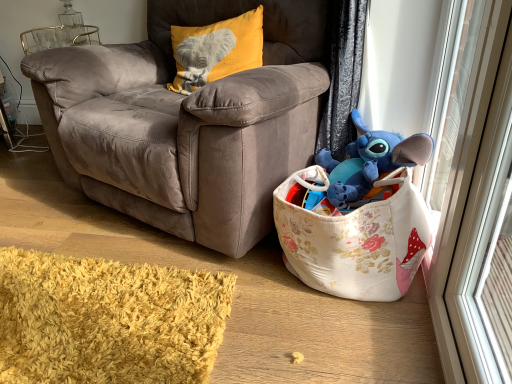
Describe the element at coordinates (476, 207) in the screenshot. The height and width of the screenshot is (384, 512). I see `transparent glass screen door at right` at that location.

Locate an element on the screen. velvet brown armchair at center is located at coordinates coord(187,122).

Where is `blue plush toy at upper right`? The width and height of the screenshot is (512, 384). blue plush toy at upper right is located at coordinates (371, 160).

Which of these two, floral fabric toy basket at lower right or blue plush toy at upper right, is thinner?

Thinner between the two is blue plush toy at upper right.

Is floral fabric toy basket at lower right looking in the opposite direction of blue plush toy at upper right?

That's not correct — floral fabric toy basket at lower right is not looking away from blue plush toy at upper right.

Would you say blue plush toy at upper right is part of floral fabric toy basket at lower right's contents?

Yes, floral fabric toy basket at lower right contains blue plush toy at upper right.

In the scene shown: From the image's perspective, between floral fabric toy basket at lower right and blue plush toy at upper right, who is located below?

floral fabric toy basket at lower right appears lower in the image.

Does transparent glass screen door at right have a greater height compared to velvet brown armchair at center?

No, transparent glass screen door at right is not taller than velvet brown armchair at center.

From a real-world perspective, is transparent glass screen door at right located beneath velvet brown armchair at center?

Yes.

Locate an element on the screen. The width and height of the screenshot is (512, 384). screen door that appears in front of the velvet brown armchair at center is located at coordinates (476, 207).

Between transparent glass screen door at right and floral fabric toy basket at lower right, which one appears on the right side from the viewer's perspective?

transparent glass screen door at right is more to the right.

Can you confirm if transparent glass screen door at right is smaller than floral fabric toy basket at lower right?

Yes.

Can you confirm if transparent glass screen door at right is taller than floral fabric toy basket at lower right?

Yes.

Looking at this image, between transparent glass screen door at right and floral fabric toy basket at lower right, which one is positioned behind?

floral fabric toy basket at lower right is behind.

Is transparent glass screen door at right inside the boundaries of blue plush toy at upper right, or outside?

transparent glass screen door at right exists outside the volume of blue plush toy at upper right.

In terms of size, does transparent glass screen door at right appear bigger or smaller than blue plush toy at upper right?

Considering their sizes, transparent glass screen door at right takes up less space than blue plush toy at upper right.

Based on their positions, is transparent glass screen door at right located to the left or right of blue plush toy at upper right?

Based on their positions, transparent glass screen door at right is located to the right of blue plush toy at upper right.

Is there a large distance between transparent glass screen door at right and blue plush toy at upper right?

transparent glass screen door at right is near blue plush toy at upper right, not far away.

Which object is further away from the camera taking this photo, velvet brown armchair at center or velvet yellow pillow with elephant design at upper left?

velvet yellow pillow with elephant design at upper left is more distant.

Can you see velvet brown armchair at center touching velvet yellow pillow with elephant design at upper left?

There is a gap between velvet brown armchair at center and velvet yellow pillow with elephant design at upper left.

From a real-world perspective, is velvet brown armchair at center physically located above or below velvet yellow pillow with elephant design at upper left?

In terms of real-world spatial position, velvet brown armchair at center is below velvet yellow pillow with elephant design at upper left.

In the scene shown: Is blue plush toy at upper right facing towards transparent glass screen door at right?

No, blue plush toy at upper right is not aimed at transparent glass screen door at right.

Does blue plush toy at upper right have a larger size compared to transparent glass screen door at right?

Correct, blue plush toy at upper right is larger in size than transparent glass screen door at right.

How different are the orientations of blue plush toy at upper right and transparent glass screen door at right in degrees?

The angle between the facing direction of blue plush toy at upper right and the facing direction of transparent glass screen door at right is 6.63 degrees.

Which is behind, blue plush toy at upper right or transparent glass screen door at right?

→ blue plush toy at upper right is further from the camera.

Considering the points (172, 103) and (490, 123), which point is behind, point (172, 103) or point (490, 123)?

The point (172, 103) is behind.

How much distance is there between velvet brown armchair at center and transparent glass screen door at right?

velvet brown armchair at center is 32.40 inches away from transparent glass screen door at right.

From a real-world perspective, which object rests below the other?

transparent glass screen door at right.

This screenshot has width=512, height=384. Find the location of `gift basket located in front of the blue plush toy at upper right`. gift basket located in front of the blue plush toy at upper right is located at coordinates (353, 239).

Locate an element on the screen. The image size is (512, 384). screen door directly beneath the velvet brown armchair at center (from a real-world perspective) is located at coordinates (476, 207).

Considering their positions, is velvet brown armchair at center positioned closer to blue plush toy at upper right than transparent glass screen door at right?

transparent glass screen door at right lies closer to blue plush toy at upper right than the other object.

Looking at the image, which one is located closer to floral fabric toy basket at lower right, blue plush toy at upper right or velvet yellow pillow with elephant design at upper left?

blue plush toy at upper right is positioned closer to the anchor floral fabric toy basket at lower right.

When comparing their distances from velvet yellow pillow with elephant design at upper left, does floral fabric toy basket at lower right or blue plush toy at upper right seem closer?

blue plush toy at upper right.

Based on their spatial positions, is transparent glass screen door at right or velvet yellow pillow with elephant design at upper left closer to blue plush toy at upper right?

transparent glass screen door at right is positioned closer to the anchor blue plush toy at upper right.

Based on the photo, which object lies further to the anchor point transparent glass screen door at right, velvet yellow pillow with elephant design at upper left or blue plush toy at upper right?

velvet yellow pillow with elephant design at upper left.

Considering their positions, is floral fabric toy basket at lower right positioned further to blue plush toy at upper right than velvet yellow pillow with elephant design at upper left?

velvet yellow pillow with elephant design at upper left is positioned further to the anchor blue plush toy at upper right.

Looking at the image, which one is located further to velvet brown armchair at center, blue plush toy at upper right or velvet yellow pillow with elephant design at upper left?

blue plush toy at upper right.

Based on their spatial positions, is velvet brown armchair at center or velvet yellow pillow with elephant design at upper left further from blue plush toy at upper right?

velvet yellow pillow with elephant design at upper left lies further to blue plush toy at upper right than the other object.

Where is `gift basket located between velvet brown armchair at center and transparent glass screen door at right in the left-right direction`? This screenshot has width=512, height=384. gift basket located between velvet brown armchair at center and transparent glass screen door at right in the left-right direction is located at coordinates (353, 239).

Locate an element on the screen. The height and width of the screenshot is (384, 512). gift basket situated between velvet brown armchair at center and blue plush toy at upper right from left to right is located at coordinates (353, 239).

Where is `chair between velvet yellow pillow with elephant design at upper left and floral fabric toy basket at lower right in the up-down direction`? This screenshot has width=512, height=384. chair between velvet yellow pillow with elephant design at upper left and floral fabric toy basket at lower right in the up-down direction is located at coordinates (187, 122).

At what (x,y) coordinates should I click in order to perform the action: click on toy between velvet brown armchair at center and transparent glass screen door at right. Please return your answer as a coordinate pair (x, y). The width and height of the screenshot is (512, 384). Looking at the image, I should click on (371, 160).